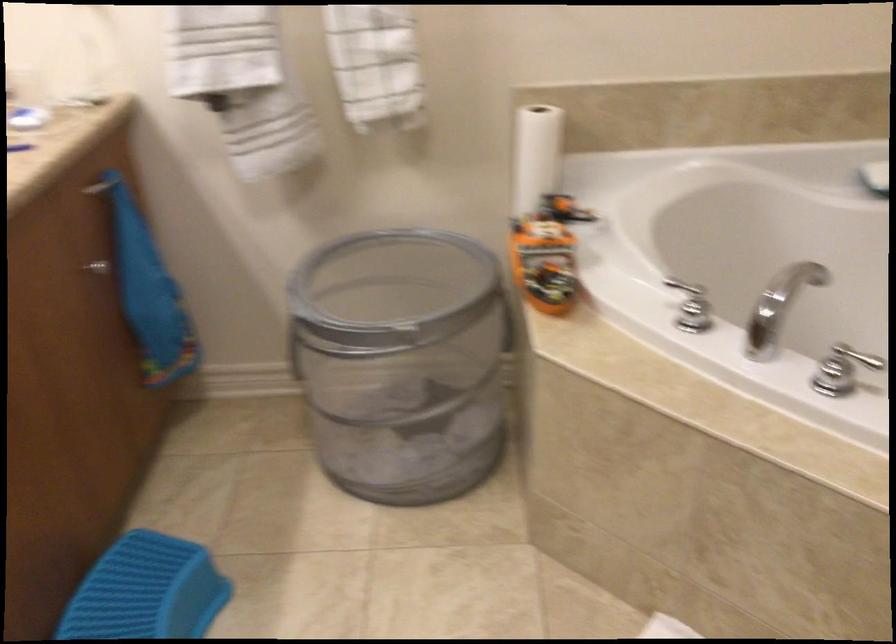
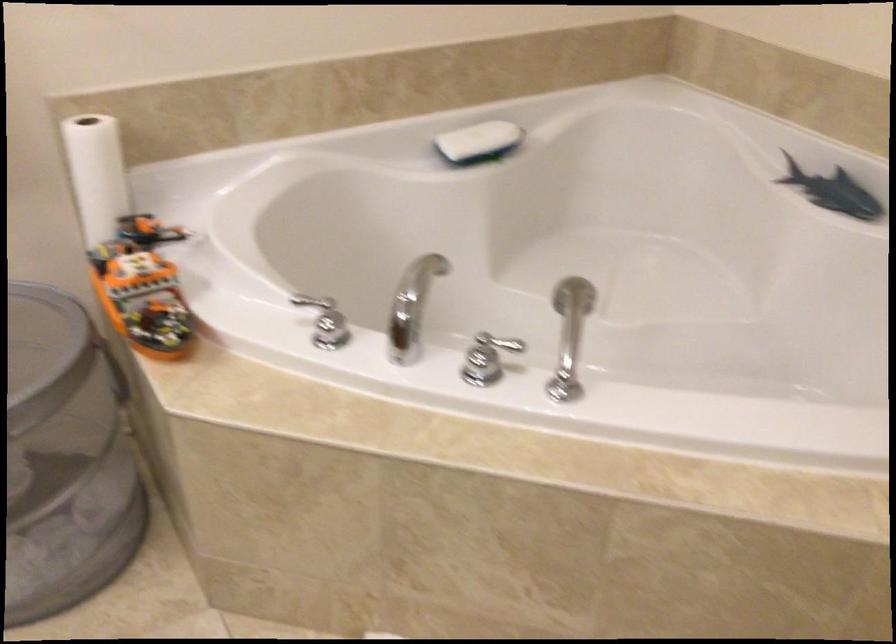
Question: The camera is either moving clockwise (left) or counter-clockwise (right) around the object. The first image is from the beginning of the video and the second image is from the end. Is the camera moving left or right when shooting the video?

Choices:
 (A) Left
 (B) Right

Answer: (A)